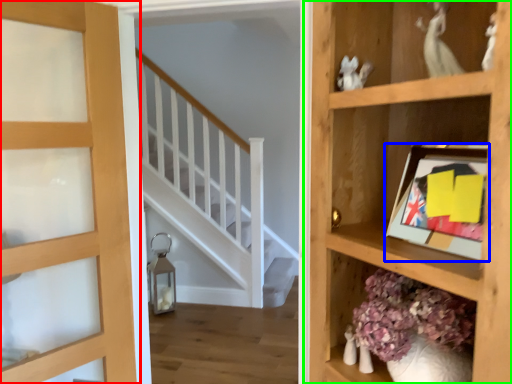
Question: Which object is the farthest from door (highlighted by a red box)? Choose among these: picture frame (highlighted by a blue box) or shelf (highlighted by a green box).

Choices:
 (A) picture frame
 (B) shelf

Answer: (A)